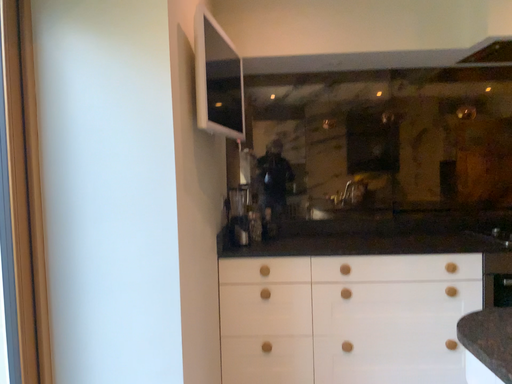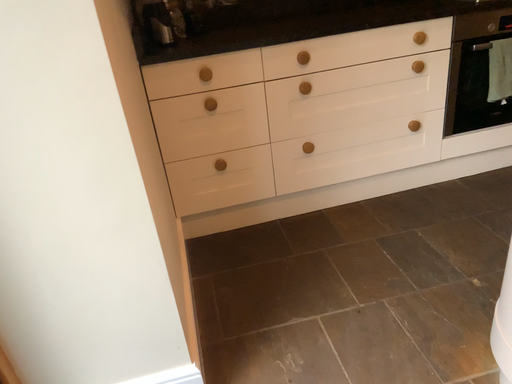
Question: Which way did the camera rotate in the video?

Choices:
 (A) rotated right
 (B) rotated left

Answer: (A)